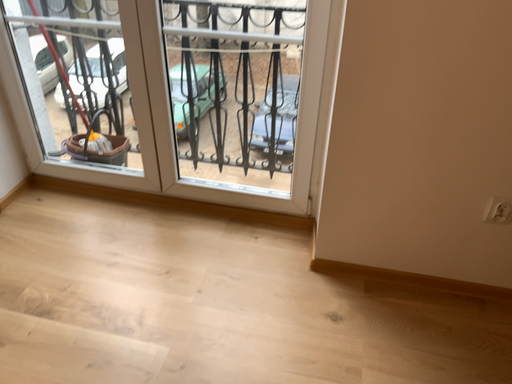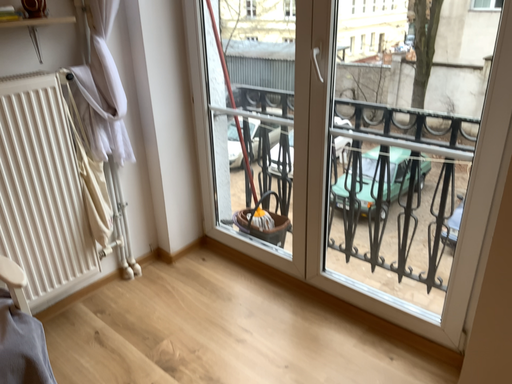
Question: Which way did the camera rotate in the video?

Choices:
 (A) rotated right
 (B) rotated left

Answer: (B)